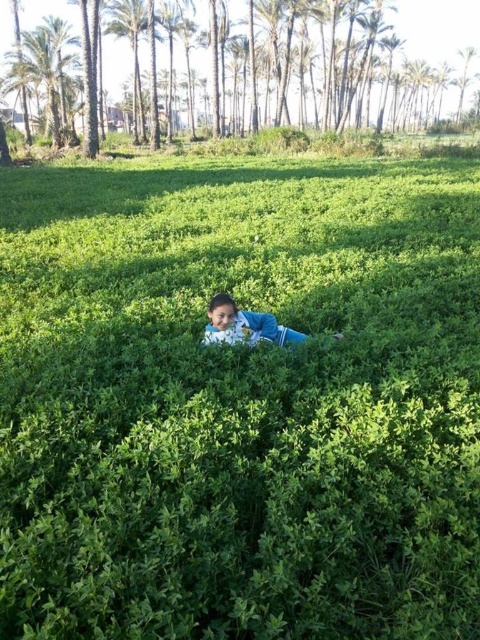
You are a photographer trying to capture a photo of the blue fabric child at center and the green leafy palm tree at upper center. Which object should you focus on first if you want to ensure both are in the frame and the smaller one is clearly visible?

The blue fabric child at center is smaller than the green leafy palm tree at upper center. To ensure both are in the frame and the smaller one is clearly visible, focus on the blue fabric child at center first, then adjust the framing to include the larger palm tree.

You are a photographer trying to capture a photo of the blue fabric child at center and the green leafy palm tree at upper center. Which object will appear smaller in the photo?

The blue fabric child at center will appear smaller in the photo because it has a lesser width compared to the green leafy palm tree at upper center.

You are standing in the lush green field and want to walk towards the palm trees in the background. If you walk straight ahead from your current position, which point will you reach first, point (255, 321) or point (136, 68)?

Point (255, 321) is in front of point (136, 68), so you will reach point (255, 321) first when walking straight ahead.